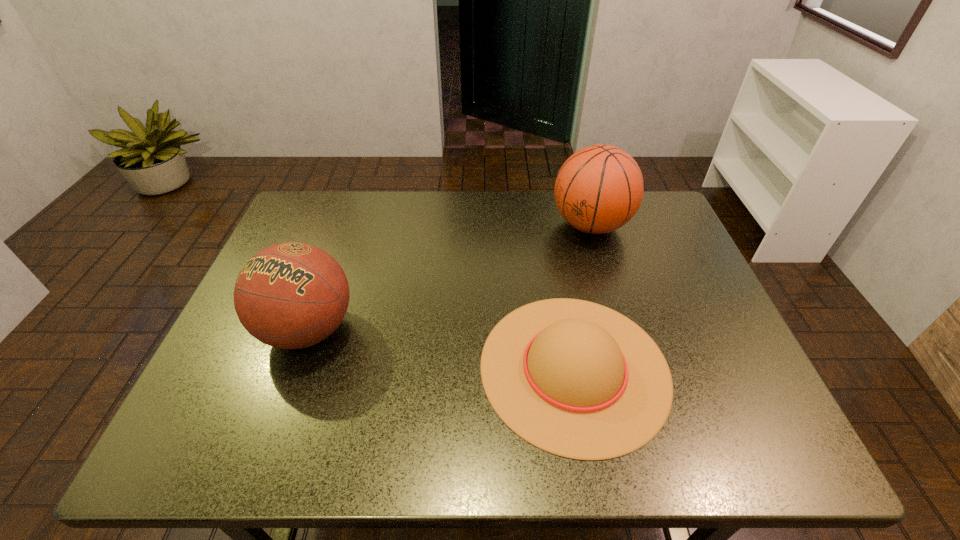
At what (x,y) coordinates should I click in order to perform the action: click on object at the left edge. Please return your answer as a coordinate pair (x, y). The image size is (960, 540). Looking at the image, I should click on (291, 295).

Where is `object that is at the right edge`? This screenshot has height=540, width=960. object that is at the right edge is located at coordinates (599, 188).

Locate an element on the screen. object that is at the far right corner is located at coordinates (599, 188).

The height and width of the screenshot is (540, 960). I want to click on vacant space at the far edge of the desktop, so click(555, 220).

Where is `vacant space at the near edge of the desktop`? vacant space at the near edge of the desktop is located at coordinates (297, 453).

Where is `vacant space at the right edge of the desktop`? The image size is (960, 540). vacant space at the right edge of the desktop is located at coordinates (700, 347).

Where is `free point at the far left corner`? Image resolution: width=960 pixels, height=540 pixels. free point at the far left corner is located at coordinates (343, 208).

Locate an element on the screen. The image size is (960, 540). blank space at the far right corner of the desktop is located at coordinates (659, 213).

Where is `vacant region between the left basketball and the farthest object`? The width and height of the screenshot is (960, 540). vacant region between the left basketball and the farthest object is located at coordinates coord(449,278).

Locate an element on the screen. The height and width of the screenshot is (540, 960). vacant space that is in between the shortest object and the left basketball is located at coordinates (442, 348).